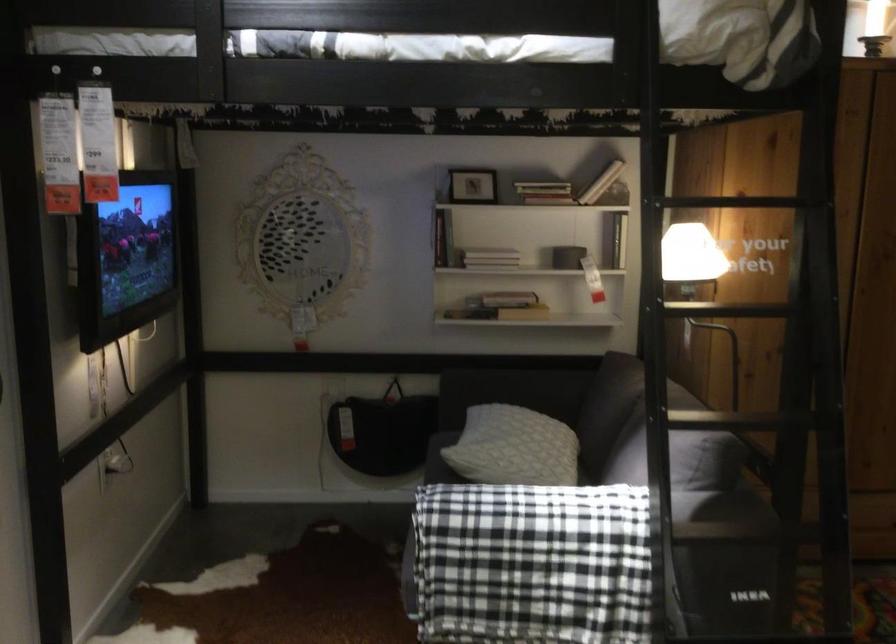
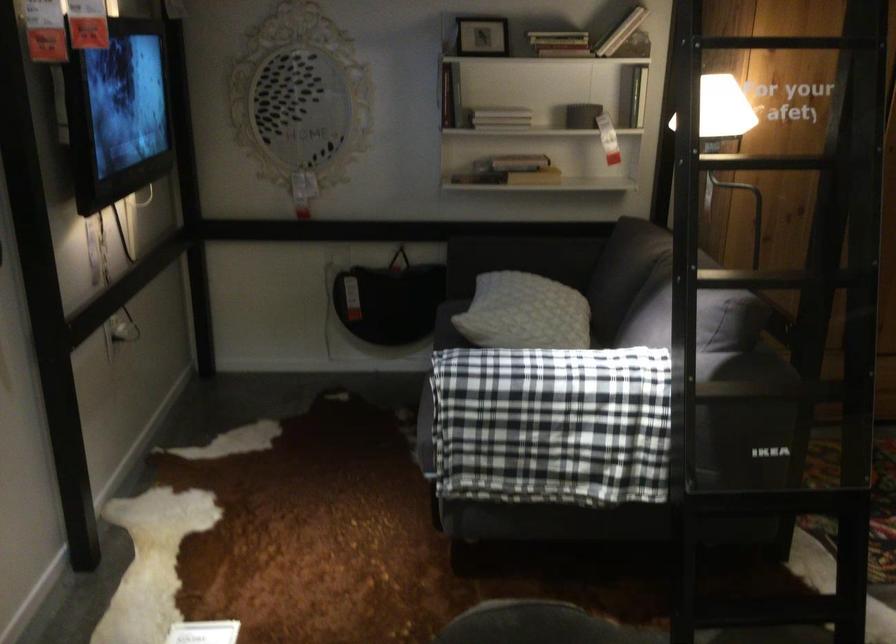
In the second image, find the point that corresponds to (550,194) in the first image.

(558, 43)